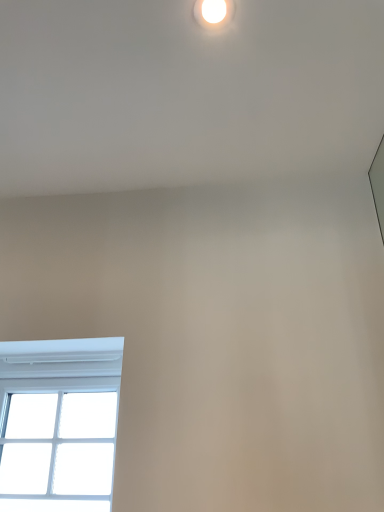
In order to click on white plastic window at lower left in this screenshot , I will do `click(59, 424)`.

Measure the distance between white plastic window at lower left and camera.

1.25 meters.

Describe the element at coordinates (59, 424) in the screenshot. I see `white plastic window at lower left` at that location.

The height and width of the screenshot is (512, 384). What do you see at coordinates (213, 13) in the screenshot?
I see `white glossy droplight at upper center` at bounding box center [213, 13].

In order to click on white glossy droplight at upper center in this screenshot , I will do `click(213, 13)`.

What is the approximate width of white glossy droplight at upper center?

white glossy droplight at upper center is 3.49 inches in width.

Locate an element on the screen. Image resolution: width=384 pixels, height=512 pixels. white plastic window at lower left is located at coordinates (59, 424).

Considering the positions of objects white plastic window at lower left and white glossy droplight at upper center in the image provided, who is more to the left, white plastic window at lower left or white glossy droplight at upper center?

Positioned to the left is white plastic window at lower left.

Considering the relative positions of white plastic window at lower left and white glossy droplight at upper center in the image provided, is white plastic window at lower left behind white glossy droplight at upper center?

Yes, white plastic window at lower left is behind white glossy droplight at upper center.

Which is in front, point (5, 358) or point (198, 7)?

The point (198, 7) is in front.

From the image's perspective, which is below, white plastic window at lower left or white glossy droplight at upper center?

white plastic window at lower left is shown below in the image.

From a real-world perspective, who is located lower, white plastic window at lower left or white glossy droplight at upper center?

From a 3D spatial view, white plastic window at lower left is below.

Between white plastic window at lower left and white glossy droplight at upper center, which one has smaller width?

Thinner between the two is white glossy droplight at upper center.

In the scene shown: Who is taller, white plastic window at lower left or white glossy droplight at upper center?

white plastic window at lower left.

Considering the relative sizes of white plastic window at lower left and white glossy droplight at upper center in the image provided, is white plastic window at lower left smaller than white glossy droplight at upper center?

Actually, white plastic window at lower left might be larger than white glossy droplight at upper center.

Would you say white glossy droplight at upper center is part of white plastic window at lower left's contents?

Definitely not — white glossy droplight at upper center is not inside white plastic window at lower left.

Based on the photo, is white plastic window at lower left far away from white glossy droplight at upper center?

Yes.

Could you tell me if white plastic window at lower left is turned towards white glossy droplight at upper center?

No, white plastic window at lower left is not facing towards white glossy droplight at upper center.

How many degrees apart are the facing directions of white plastic window at lower left and white glossy droplight at upper center?

They differ by 4.48 degrees in their facing directions.

What are the coordinates of `window lying on the left of white glossy droplight at upper center` in the screenshot? It's located at (59, 424).

Between white glossy droplight at upper center and white plastic window at lower left, which one appears on the right side from the viewer's perspective?

Positioned to the right is white glossy droplight at upper center.

Which object is further away from the camera taking this photo, white glossy droplight at upper center or white plastic window at lower left?

white plastic window at lower left is behind.

Considering the points (220, 26) and (48, 426), which point is behind, point (220, 26) or point (48, 426)?

Positioned behind is point (48, 426).

From the image's perspective, which object appears higher, white glossy droplight at upper center or white plastic window at lower left?

white glossy droplight at upper center is shown above in the image.

From a real-world perspective, is white glossy droplight at upper center below white plastic window at lower left?

No, from a real-world perspective, white glossy droplight at upper center is not beneath white plastic window at lower left.

Is white glossy droplight at upper center wider than white plastic window at lower left?

Incorrect, the width of white glossy droplight at upper center does not surpass that of white plastic window at lower left.

Based on the photo, in terms of height, does white glossy droplight at upper center look taller or shorter compared to white plastic window at lower left?

Considering their sizes, white glossy droplight at upper center has less height than white plastic window at lower left.

Who is bigger, white glossy droplight at upper center or white plastic window at lower left?

With larger size is white plastic window at lower left.

Is white plastic window at lower left surrounded by white glossy droplight at upper center?

No.

Based on the photo, is white glossy droplight at upper center next to white plastic window at lower left and touching it?

No.

Is white plastic window at lower left at the back of white glossy droplight at upper center?

No, white glossy droplight at upper center is not facing the opposite direction of white plastic window at lower left.

How different are the orientations of white glossy droplight at upper center and white plastic window at lower left in degrees?

The facing directions of white glossy droplight at upper center and white plastic window at lower left are 4.48 degrees apart.

You are a GUI agent. You are given a task and a screenshot of the screen. Output one action in this format:
    pyautogui.click(x=<x>, y=<y>)
    Task: Click on the window on the left side of white glossy droplight at upper center
    
    Given the screenshot: What is the action you would take?
    pyautogui.click(x=59, y=424)

The image size is (384, 512). I want to click on window behind the white glossy droplight at upper center, so click(59, 424).

The height and width of the screenshot is (512, 384). Find the location of `window below the white glossy droplight at upper center (from the image's perspective)`. window below the white glossy droplight at upper center (from the image's perspective) is located at coordinates (59, 424).